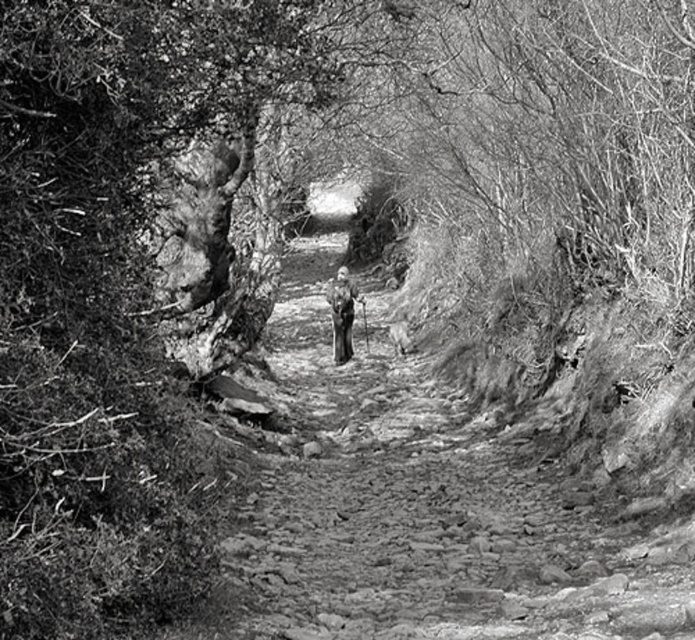
You are standing at the entrance of the dirt path at center and see the dark gray fabric jacket at center lying on the ground. Which object is closer to the ground?

The dirt path at center is located below dark gray fabric jacket at center, so the dirt path at center is closer to the ground.

You are standing in the middle of the dirt path at center and see the dark gray fabric jacket at center. Which direction should you walk to reach the jacket?

The dirt path at center is to the right of the dark gray fabric jacket at center, so you should walk to your left to reach the jacket.